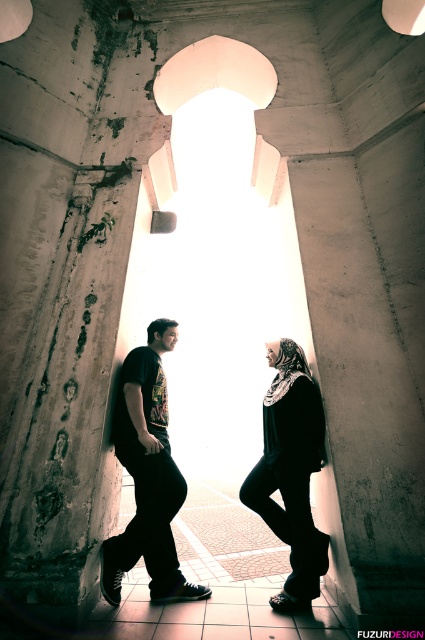
Measure the distance between matte black clothing at center and camera.

matte black clothing at center and camera are 3.05 meters apart from each other.

Can you confirm if matte black clothing at center is wider than dark matte t-shirt at center?

In fact, matte black clothing at center might be narrower than dark matte t-shirt at center.

Which is in front, point (305, 560) or point (149, 556)?

Point (305, 560)

The width and height of the screenshot is (425, 640). Identify the location of matte black clothing at center. click(147, 476).

Does dark matte t-shirt at center have a smaller size compared to black fabric hijab at center?

Actually, dark matte t-shirt at center might be larger than black fabric hijab at center.

Which is behind, point (113, 588) or point (266, 499)?

Positioned behind is point (266, 499).

Locate an element on the screen. The height and width of the screenshot is (640, 425). dark matte t-shirt at center is located at coordinates (147, 476).

Can you confirm if matte black clothing at center is wider than black fabric hijab at center?

Yes, matte black clothing at center is wider than black fabric hijab at center.

Which of these two, matte black clothing at center or black fabric hijab at center, stands shorter?

black fabric hijab at center is shorter.

You are a GUI agent. You are given a task and a screenshot of the screen. Output one action in this format:
    pyautogui.click(x=<x>, y=<y>)
    Task: Click on the matte black clothing at center
    Image resolution: width=425 pixels, height=640 pixels.
    Given the screenshot: What is the action you would take?
    pyautogui.click(x=147, y=476)